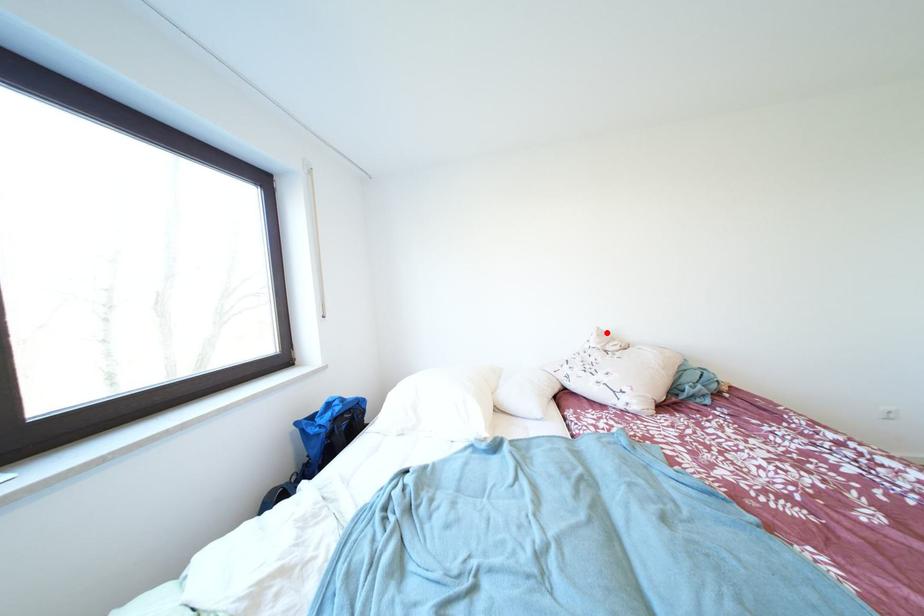
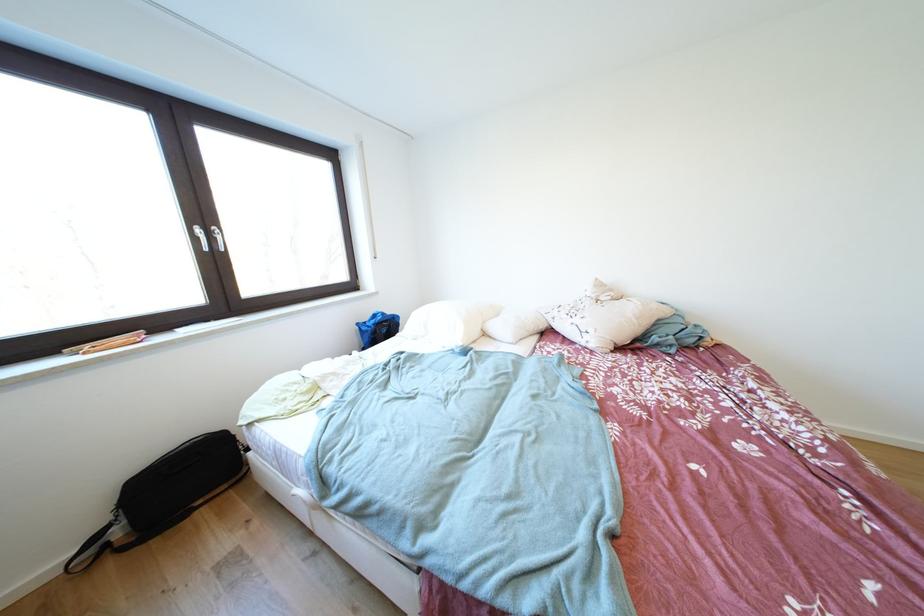
Locate, in the second image, the point that corresponds to the highlighted location in the first image.

(604, 284)